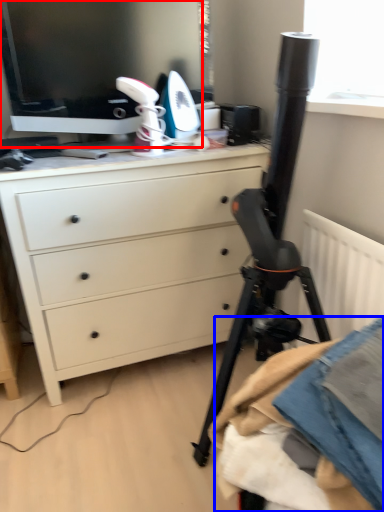
Question: Which point is closer to the camera, computer monitor (highlighted by a red box) or clothing (highlighted by a blue box)?

Choices:
 (A) computer monitor
 (B) clothing

Answer: (B)